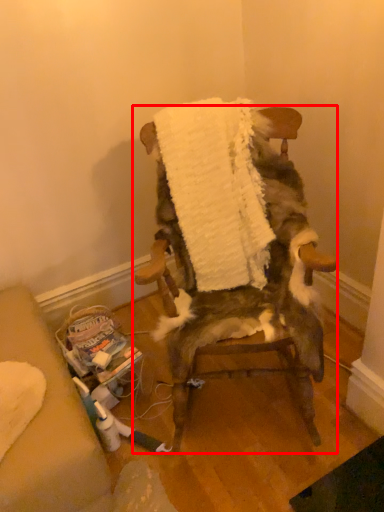
Question: From the image's perspective, where is chair (annotated by the red box) located in relation to blanket in the image?

Choices:
 (A) below
 (B) above

Answer: (A)